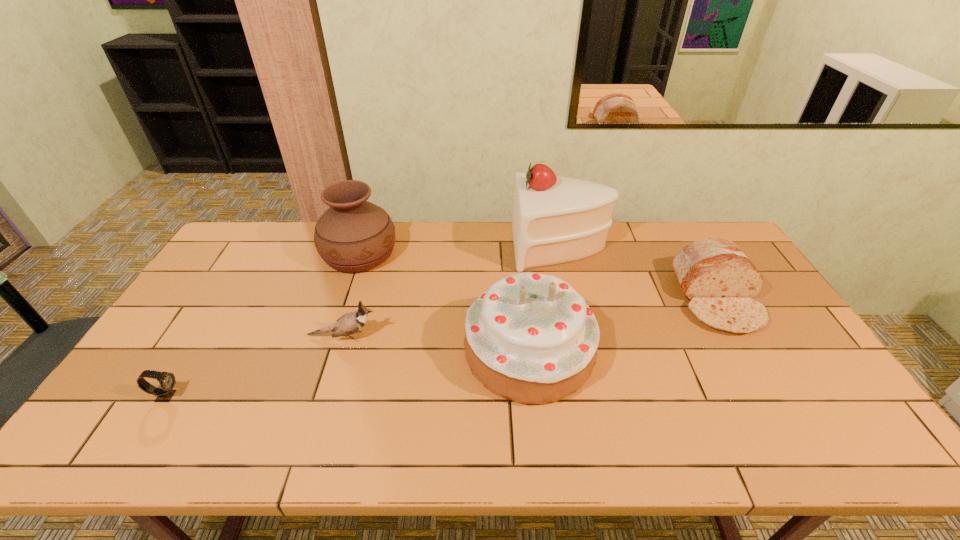
This screenshot has width=960, height=540. Identify the location of unoccupied position between the shortest object and the bird. (254, 366).

Find the location of `vacant region between the tallest object and the bread`. vacant region between the tallest object and the bread is located at coordinates (638, 273).

Find the location of a particular element. This screenshot has height=540, width=960. object that can be found as the fifth closest to the bird is located at coordinates (717, 278).

Select which object appears as the fourth closest to the bread. Please provide its 2D coordinates. Your answer should be formatted as a tuple, i.e. [(x, y)], where the tuple contains the x and y coordinates of a point satisfying the conditions above.

[(353, 235)]

I want to click on vacant region that satisfies the following two spatial constraints: 1. at the sliced end of the bread; 2. at the face of the bird, so click(x=738, y=337).

Where is `vacant region that satisfies the following two spatial constraints: 1. on the back side of the farther cake; 2. on the right side of the urn`? The width and height of the screenshot is (960, 540). vacant region that satisfies the following two spatial constraints: 1. on the back side of the farther cake; 2. on the right side of the urn is located at coordinates (362, 247).

Where is `vacant space that satisfies the following two spatial constraints: 1. at the face of the shorter cake; 2. on the left side of the bird`? This screenshot has width=960, height=540. vacant space that satisfies the following two spatial constraints: 1. at the face of the shorter cake; 2. on the left side of the bird is located at coordinates (339, 351).

Where is `vacant space that satisfies the following two spatial constraints: 1. at the sliced end of the bread; 2. at the face of the bird`? Image resolution: width=960 pixels, height=540 pixels. vacant space that satisfies the following two spatial constraints: 1. at the sliced end of the bread; 2. at the face of the bird is located at coordinates (738, 337).

You are a GUI agent. You are given a task and a screenshot of the screen. Output one action in this format:
    pyautogui.click(x=<x>, y=<y>)
    Task: Click on the vacant area that satisfies the following two spatial constraints: 1. at the sliced end of the rightmost object; 2. at the face of the bird
    
    Given the screenshot: What is the action you would take?
    pyautogui.click(x=738, y=337)